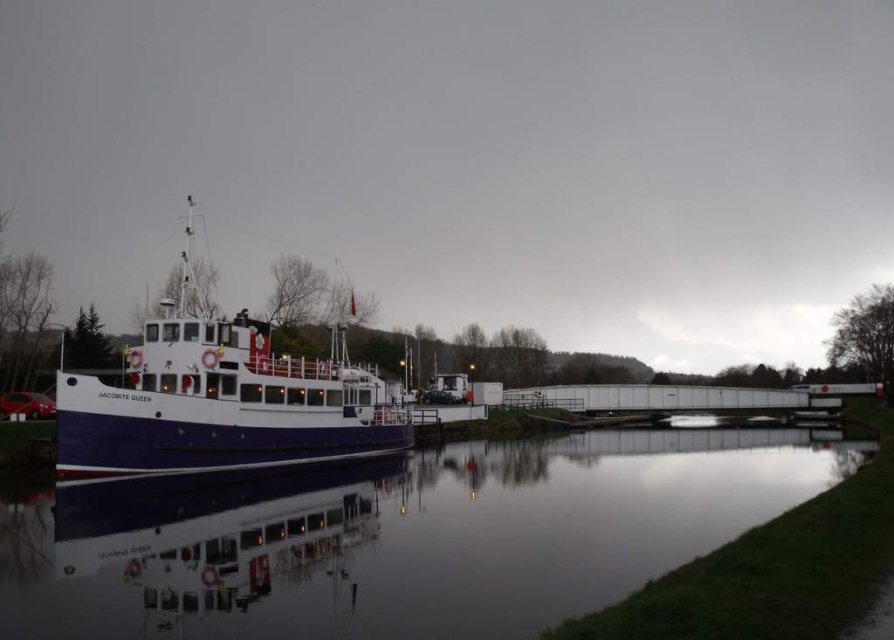
Question: Can you confirm if smooth water at lower center is wider than white glossy boat at left?

Choices:
 (A) yes
 (B) no

Answer: (B)

Question: Which object appears closest to the camera in this image?

Choices:
 (A) smooth water at lower center
 (B) white glossy boat at left

Answer: (A)

Question: Does smooth water at lower center have a lesser width compared to white glossy boat at left?

Choices:
 (A) no
 (B) yes

Answer: (B)

Question: Is smooth water at lower center to the right of white glossy boat at left from the viewer's perspective?

Choices:
 (A) yes
 (B) no

Answer: (A)

Question: Which object is closer to the camera taking this photo?

Choices:
 (A) smooth water at lower center
 (B) white glossy boat at left

Answer: (A)

Question: Among these points, which one is nearest to the camera?

Choices:
 (A) (443, 632)
 (B) (246, 403)

Answer: (A)